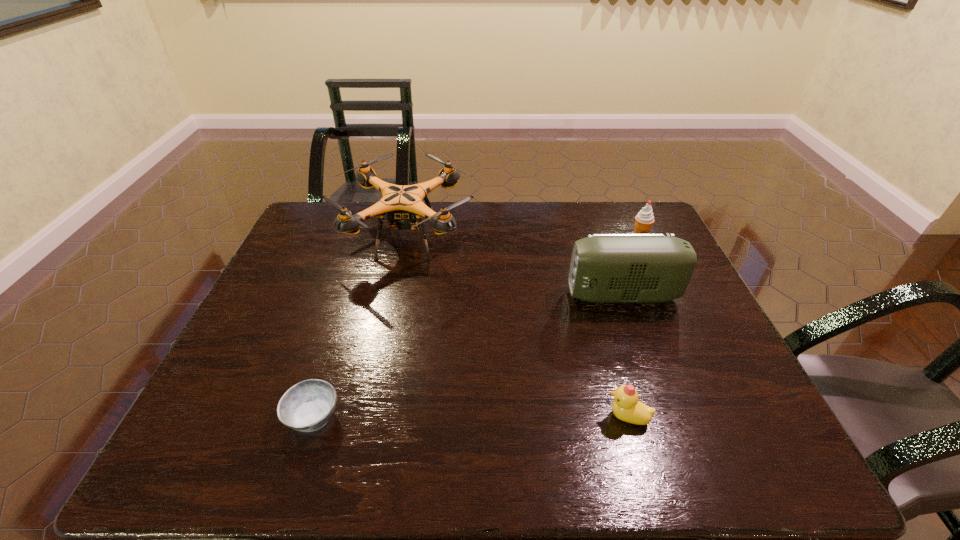
The height and width of the screenshot is (540, 960). Identify the location of object that is at the far left corner. (402, 204).

You are a GUI agent. You are given a task and a screenshot of the screen. Output one action in this format:
    pyautogui.click(x=<x>, y=<y>)
    Task: Click on the object that is positioned at the far right corner
    The image size is (960, 540).
    Given the screenshot: What is the action you would take?
    pyautogui.click(x=643, y=221)

At what (x,y) coordinates should I click in order to perform the action: click on vacant space at the far edge. Please return your answer as a coordinate pair (x, y). The width and height of the screenshot is (960, 540). Looking at the image, I should click on [x=503, y=212].

This screenshot has width=960, height=540. In the image, there is a desktop. Find the location of `vacant region at the near edge`. vacant region at the near edge is located at coordinates (697, 466).

Where is `free space at the left edge of the desktop`? free space at the left edge of the desktop is located at coordinates tap(309, 264).

Identify the location of free spot at the right edge of the desktop. The width and height of the screenshot is (960, 540). (741, 369).

This screenshot has height=540, width=960. I want to click on free space at the far right corner of the desktop, so click(x=610, y=211).

Image resolution: width=960 pixels, height=540 pixels. In order to click on vacant point located between the icecream and the duckling in this screenshot , I will do `click(634, 327)`.

You are a GUI agent. You are given a task and a screenshot of the screen. Output one action in this format:
    pyautogui.click(x=<x>, y=<y>)
    Task: Click on the free space between the shortest object and the drone
    This screenshot has width=960, height=540.
    Given the screenshot: What is the action you would take?
    pyautogui.click(x=360, y=327)

Where is `free space that is in between the third tallest object and the drone`? The height and width of the screenshot is (540, 960). free space that is in between the third tallest object and the drone is located at coordinates (523, 238).